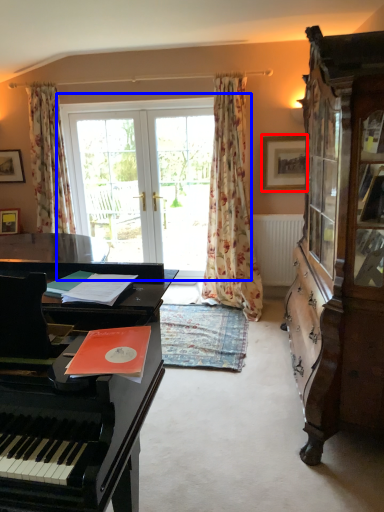
Question: Which point is closer to the camera, picture frame (highlighted by a red box) or bay window (highlighted by a blue box)?

Choices:
 (A) picture frame
 (B) bay window

Answer: (A)